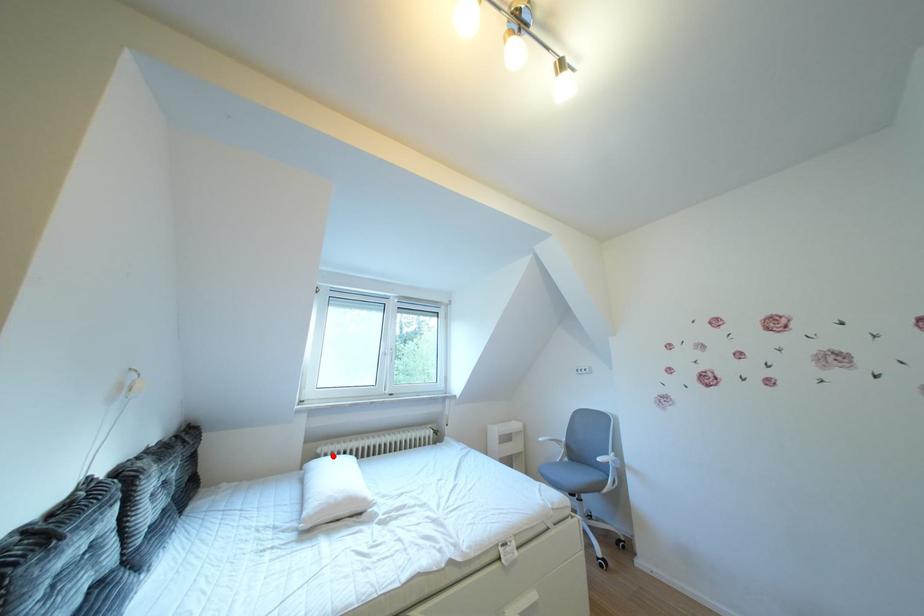
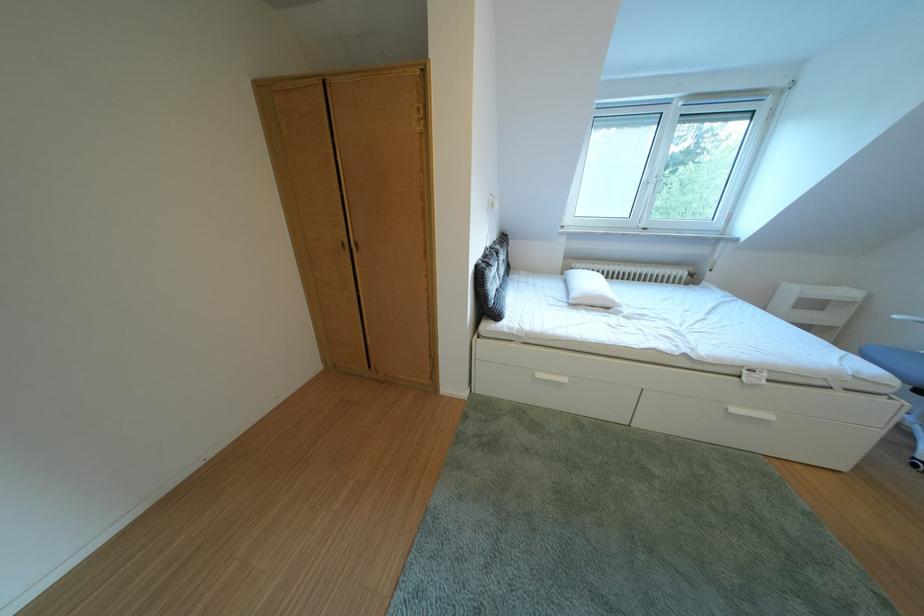
Where in the second image is the point corresponding to the highlighted location from the first image?

(588, 270)